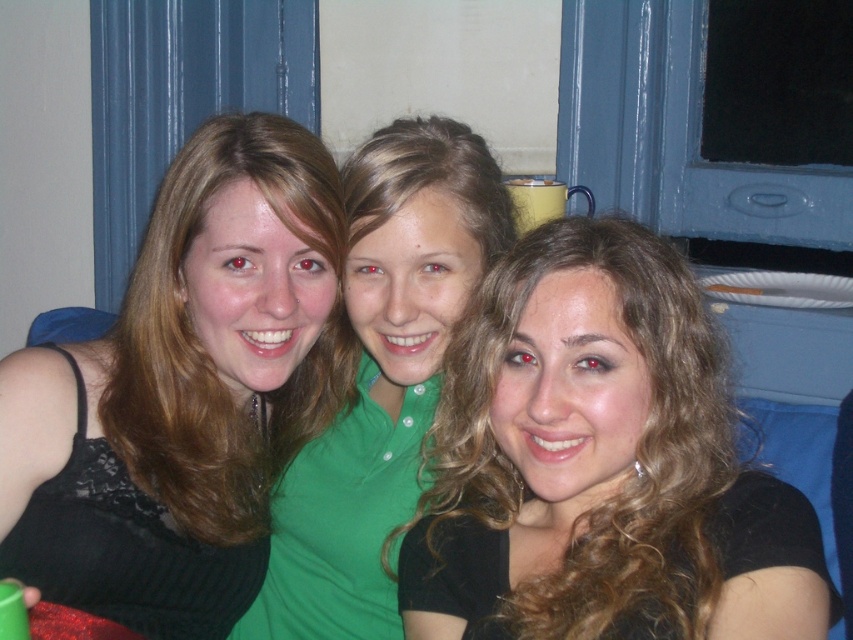
You are a photographer trying to adjust the lighting for a group photo. You notice two dark elements in the image, the matte black tank top at left and the black matte hair at center. Which of these two elements might require more light to avoid appearing too dark in the final photo?

The matte black tank top at left is bigger than the black matte hair at center, so it might require more light to avoid appearing too dark in the final photo because larger dark surfaces can absorb more light and may need additional illumination.

You are a photographer adjusting the lighting for a portrait. You notice a point at coordinates (x=590, y=454) in the image. What object or feature is located at this point?

The point at coordinates (x=590, y=454) indicates the black matte hair at center.